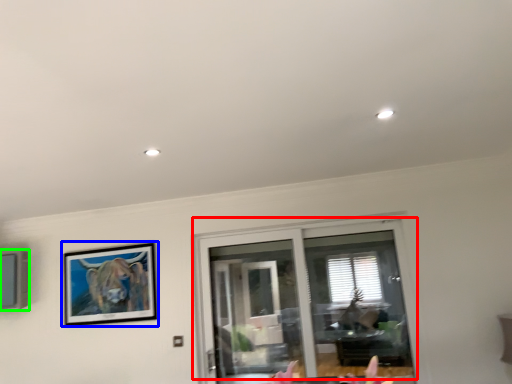
Question: Which object is the closest to the window (highlighted by a red box)? Choose among these: picture frame (highlighted by a blue box) or picture frame (highlighted by a green box).

Choices:
 (A) picture frame
 (B) picture frame

Answer: (A)